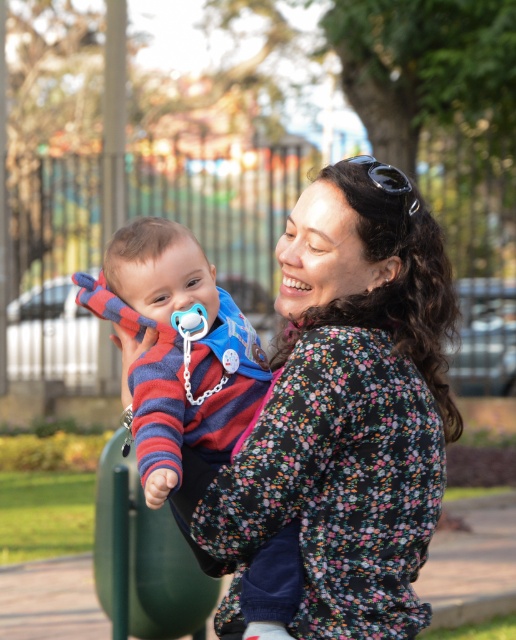
Question: Can you confirm if floral print blouse at center is smaller than striped fabric baby at center?

Choices:
 (A) yes
 (B) no

Answer: (B)

Question: Is floral print blouse at center thinner than striped fabric baby at center?

Choices:
 (A) no
 (B) yes

Answer: (A)

Question: Which object is closer to the camera taking this photo?

Choices:
 (A) striped fabric baby at center
 (B) floral print blouse at center

Answer: (B)

Question: Is floral print blouse at center to the right of striped fabric baby at center from the viewer's perspective?

Choices:
 (A) no
 (B) yes

Answer: (B)